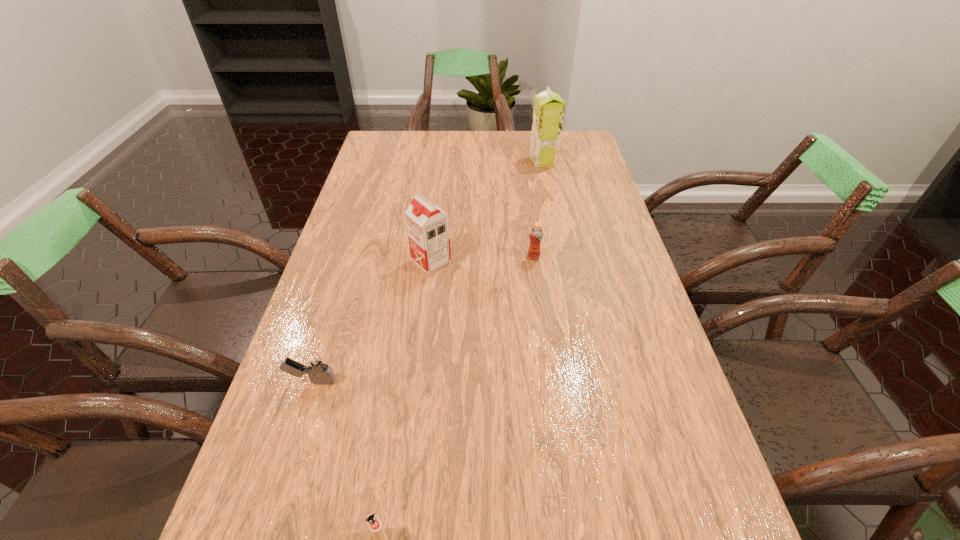
This screenshot has width=960, height=540. Find the location of `vacant space that's between the rightmost object and the second object from right to left`. vacant space that's between the rightmost object and the second object from right to left is located at coordinates (539, 208).

Locate an element on the screen. This screenshot has height=540, width=960. free spot between the taller soya milk and the nearer soya milk is located at coordinates (487, 211).

Select which object is the fourth closest to the nearer igniter. Please provide its 2D coordinates. Your answer should be formatted as a tuple, i.e. [(x, y)], where the tuple contains the x and y coordinates of a point satisfying the conditions above.

[(548, 113)]

In order to click on the fourth closest object to the second tallest object in this screenshot , I will do `click(374, 524)`.